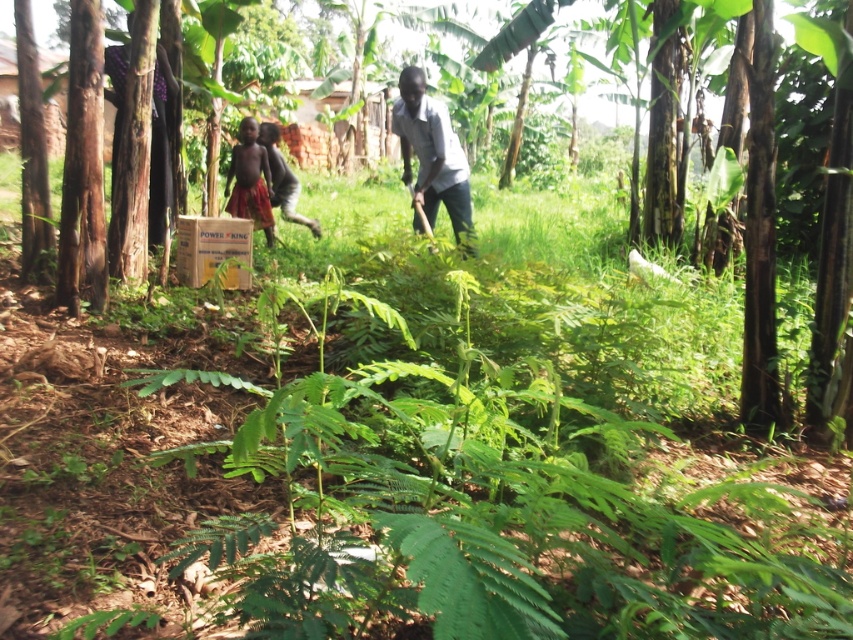
You are standing in the rural outdoor scene described. There are two points marked in the image. Which point, point (x=403, y=144) or point (x=312, y=228), is closer to you?

Point (x=403, y=144) is closer to the viewer than point (x=312, y=228).